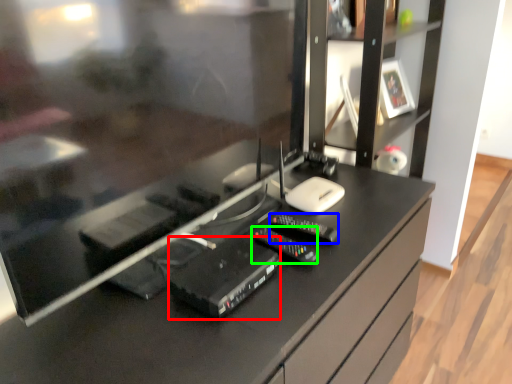
Question: Estimate the real-world distances between objects in this image. Which object is farther from equipment (highlighted by a red box), control (highlighted by a blue box) or equipment (highlighted by a green box)?

Choices:
 (A) control
 (B) equipment

Answer: (A)